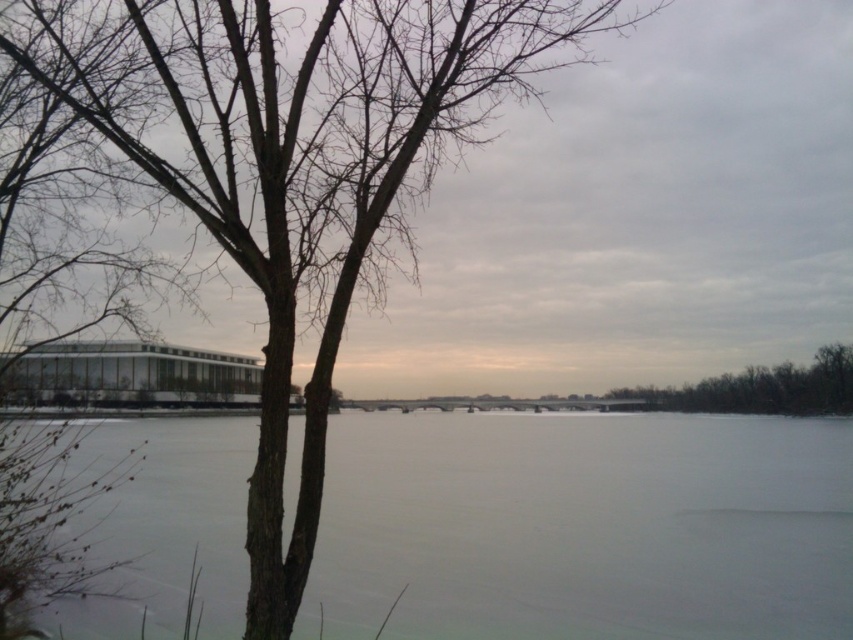
Question: Among these objects, which one is farthest from the camera?

Choices:
 (A) white ice at center
 (B) brown bark tree at right

Answer: (B)

Question: Which of the following is the closest to the observer?

Choices:
 (A) white ice at center
 (B) brown bark tree at right

Answer: (A)

Question: Does white ice at center come behind brown bark tree at right?

Choices:
 (A) no
 (B) yes

Answer: (A)

Question: Can you confirm if white ice at center is positioned above brown bark tree at right?

Choices:
 (A) no
 (B) yes

Answer: (A)

Question: Among these objects, which one is nearest to the camera?

Choices:
 (A) brown bark tree at right
 (B) white ice at center

Answer: (B)

Question: Is white ice at center thinner than brown bark tree at right?

Choices:
 (A) yes
 (B) no

Answer: (A)